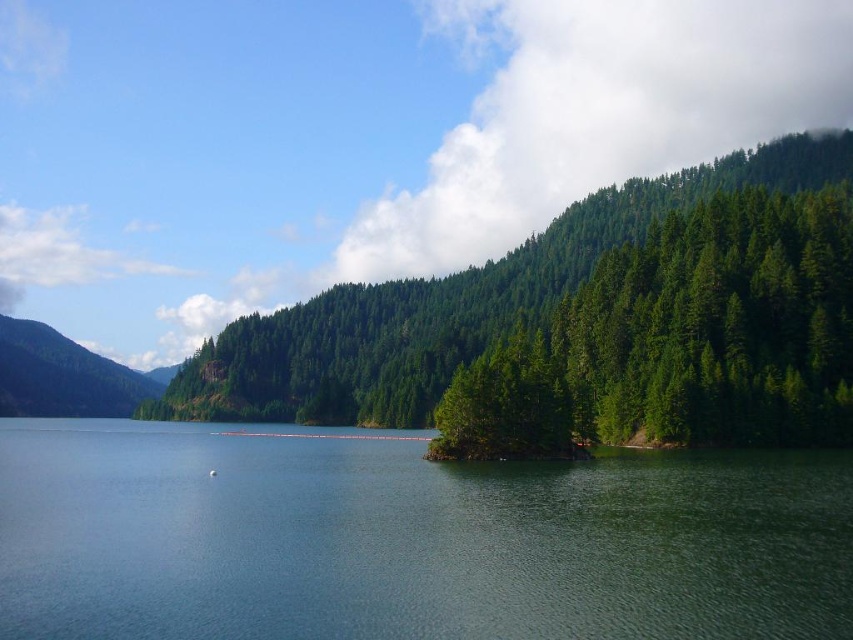
You are a hiker standing at the edge of the green smooth water at center and looking towards the green forested mountain at left. Which object is taller?

The green forested mountain at left is taller than the green smooth water at center.

You are a hiker standing at the edge of the lake looking towards the island. Which of the green matte trees at right or green matte tree at center is closer to you?

The green matte trees at right is closer to you because it is in front of the green matte tree at center.